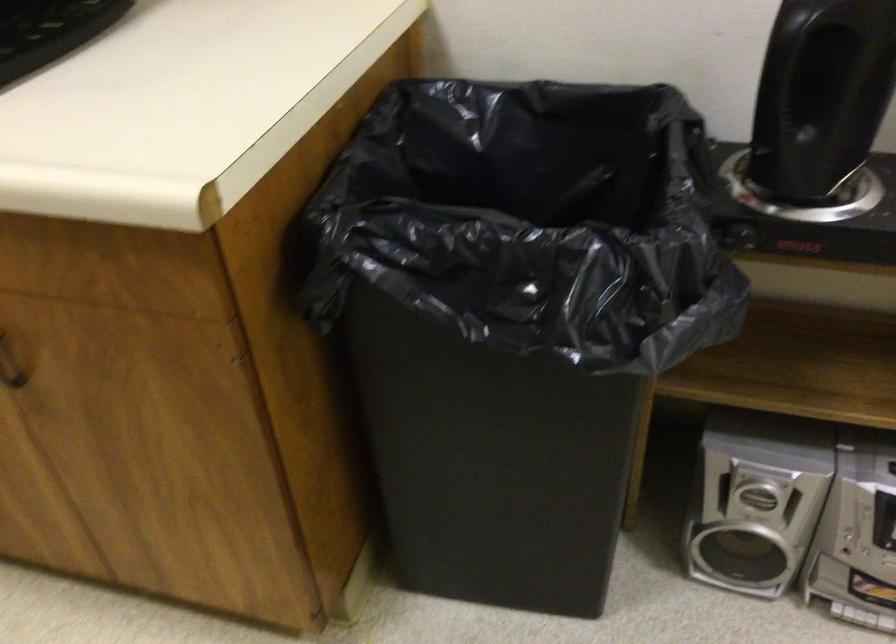
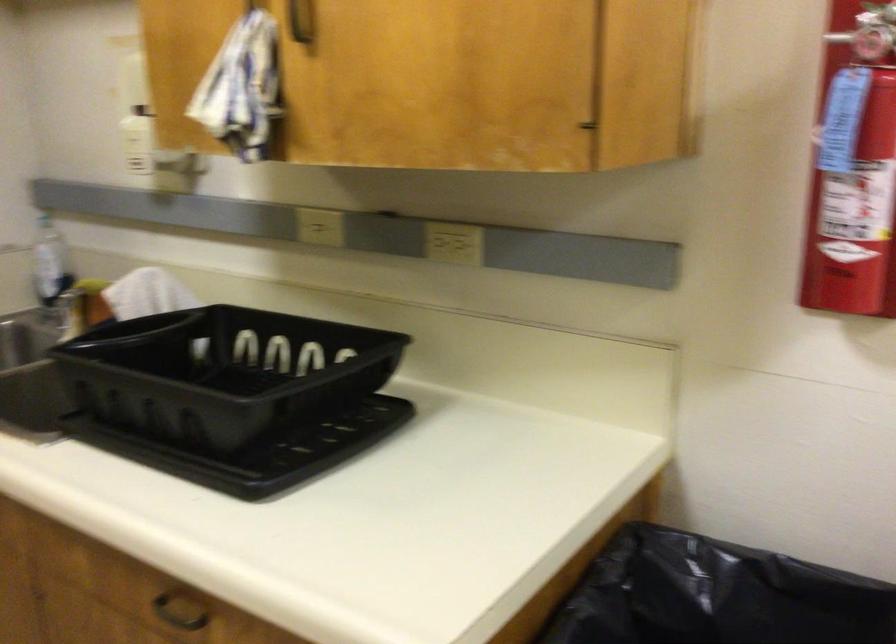
Based on the continuous images, in which direction is the camera rotating?

The camera's rotation is toward left-up.